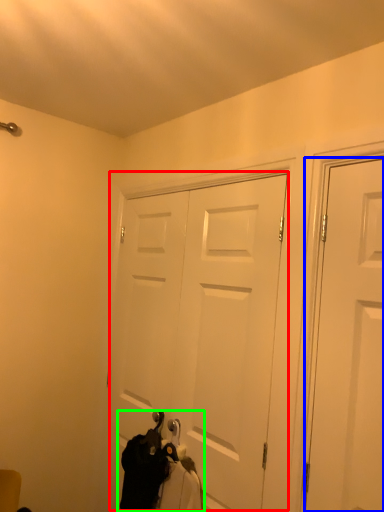
Question: Which is farther away from door (highlighted by a red box)? door (highlighted by a blue box) or laundry (highlighted by a green box)?

Choices:
 (A) door
 (B) laundry

Answer: (A)